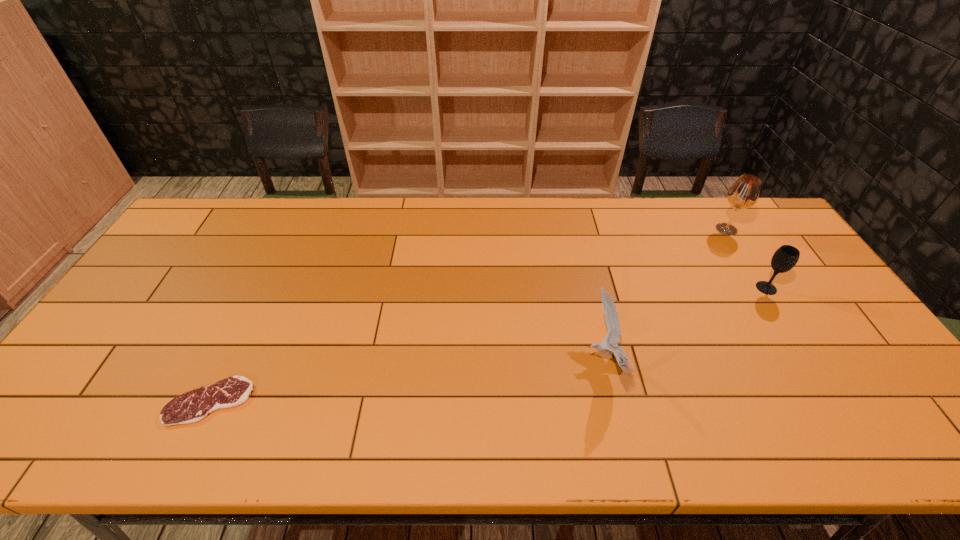
Identify the location of the taller wineglass. This screenshot has height=540, width=960. (744, 193).

This screenshot has width=960, height=540. I want to click on the farthest object, so click(744, 193).

Identify the location of the third nearest object. Image resolution: width=960 pixels, height=540 pixels. (785, 258).

The width and height of the screenshot is (960, 540). What are the coordinates of `the nearer wineglass` in the screenshot? It's located at (785, 258).

Identify the location of gull. The image size is (960, 540). (612, 338).

You are a GUI agent. You are given a task and a screenshot of the screen. Output one action in this format:
    pyautogui.click(x=<x>, y=<y>)
    Task: Click on the steak
    
    Given the screenshot: What is the action you would take?
    pyautogui.click(x=193, y=406)

Find the location of a particular element. This screenshot has width=960, height=540. the leftmost object is located at coordinates (193, 406).

The height and width of the screenshot is (540, 960). I want to click on free location located on the right of the tallest object, so click(x=763, y=230).

Locate an element on the screen. The width and height of the screenshot is (960, 540). free point located on the back of the third nearest object is located at coordinates (721, 216).

The width and height of the screenshot is (960, 540). In order to click on vacant region located 0.140m at the tip of the beak of the gull in this screenshot , I will do `click(529, 360)`.